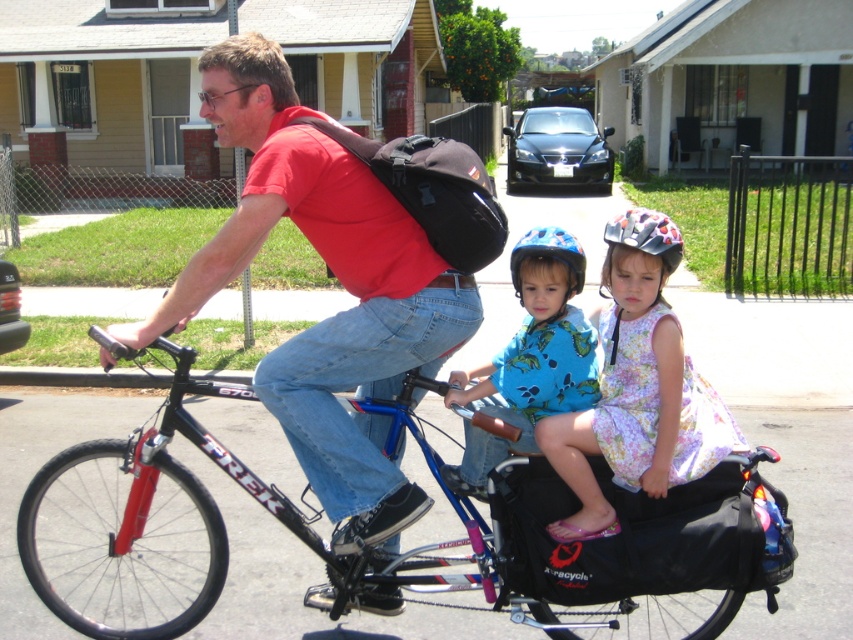
Question: Is red matte shirt at center bigger than multicolored plastic helmet at center?

Choices:
 (A) yes
 (B) no

Answer: (A)

Question: Can you confirm if floral dress at center is bigger than black fabric backpack at center?

Choices:
 (A) no
 (B) yes

Answer: (B)

Question: Considering the relative positions of black metallic bicycle at center and blue matte helmet at center in the image provided, where is black metallic bicycle at center located with respect to blue matte helmet at center?

Choices:
 (A) right
 (B) left

Answer: (B)

Question: Among these objects, which one is farthest from the camera?

Choices:
 (A) black fabric backpack at center
 (B) blue matte helmet at center
 (C) multicolored plastic helmet at center
 (D) red matte shirt at center

Answer: (A)

Question: Which object is positioned farthest from the multicolored plastic helmet at center?

Choices:
 (A) black metallic bicycle at center
 (B) red matte shirt at center

Answer: (A)

Question: Which of these objects is positioned closest to the black fabric backpack at center?

Choices:
 (A) red matte shirt at center
 (B) multicolored plastic helmet at center

Answer: (A)